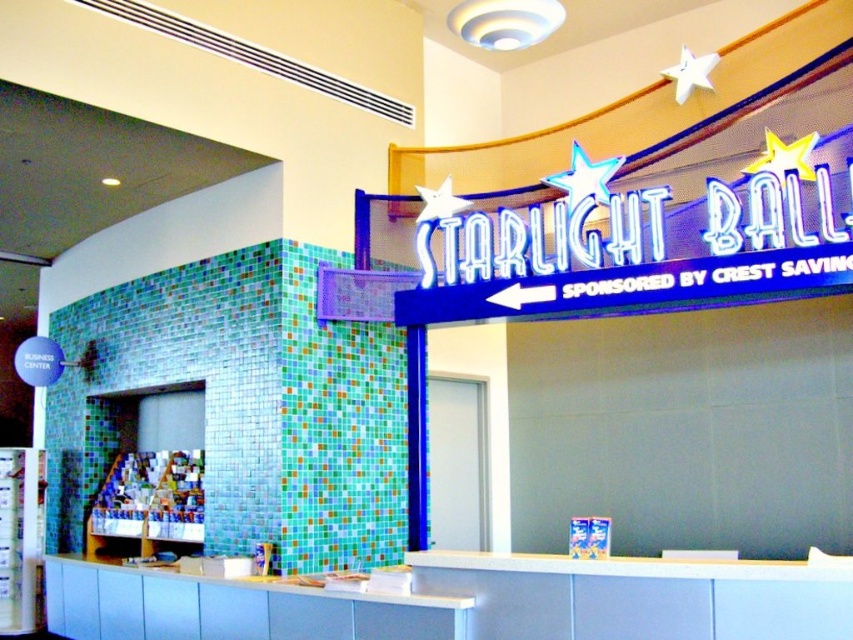
Question: Does neon blue star at upper center have a greater width compared to metallic silver star at upper right?

Choices:
 (A) yes
 (B) no

Answer: (A)

Question: Which of the following is the closest to the observer?

Choices:
 (A) neon blue star at upper center
 (B) metallic silver star at upper center

Answer: (A)

Question: Estimate the real-world distances between objects in this image. Which object is farther from the neon blue star at upper center?

Choices:
 (A) metallic silver star at upper right
 (B) metallic silver star at upper center
 (C) metallic yellow star at upper right
 (D) white glossy bulletin board at left

Answer: (D)

Question: Can you confirm if white glossy bulletin board at left is bigger than neon blue star at upper center?

Choices:
 (A) yes
 (B) no

Answer: (A)

Question: Does white glossy bulletin board at left appear on the right side of metallic silver star at upper right?

Choices:
 (A) no
 (B) yes

Answer: (A)

Question: Which of the following is the closest to the observer?

Choices:
 (A) (689, 81)
 (B) (762, 163)

Answer: (B)